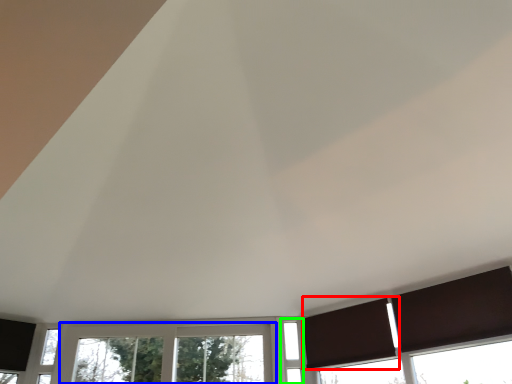
Question: Which is farther away from curtain (highlighted by a red box)? window (highlighted by a blue box) or window (highlighted by a green box)?

Choices:
 (A) window
 (B) window

Answer: (A)